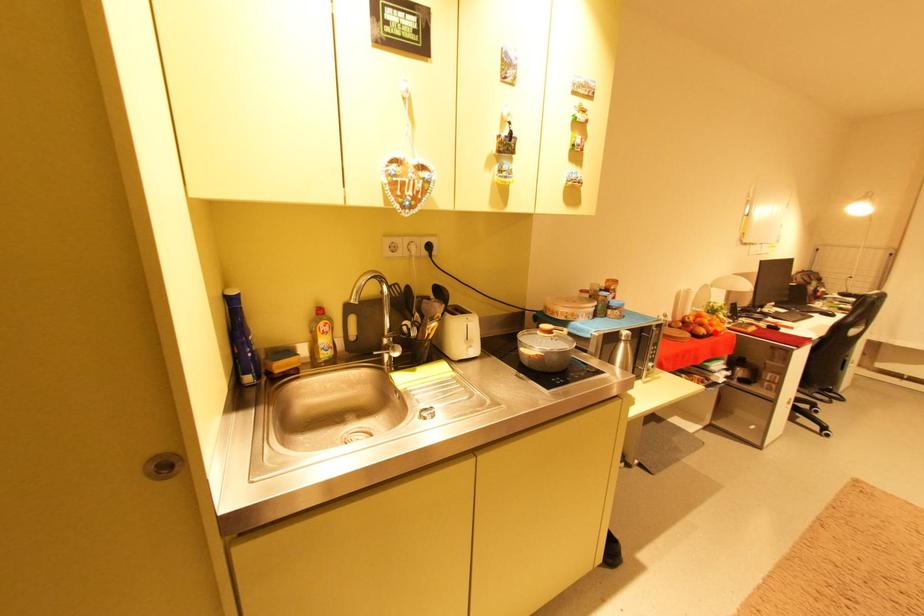
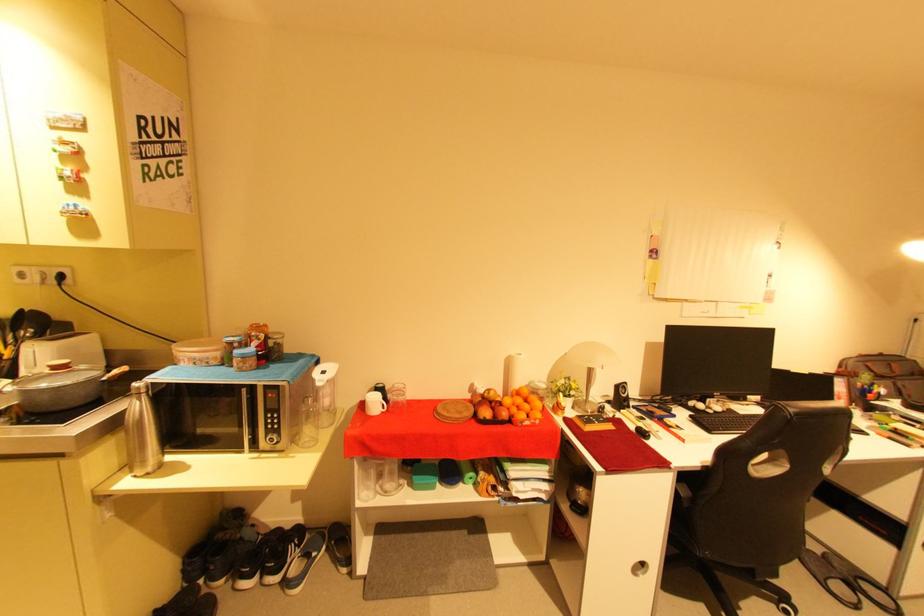
The point at the highlighted location is marked in the first image. Where is the corresponding point in the second image?

(503, 416)